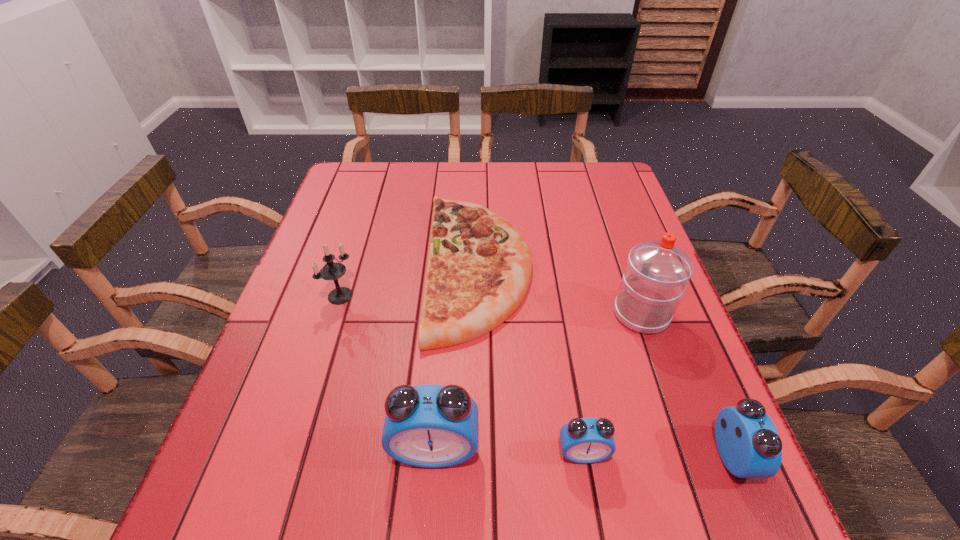
The image size is (960, 540). I want to click on free space at the right edge of the desktop, so click(x=612, y=246).

The height and width of the screenshot is (540, 960). I want to click on vacant position at the far left corner of the desktop, so click(x=371, y=181).

Locate an element on the screen. blank area at the near right corner is located at coordinates (659, 430).

Where is `empty space that is in between the third object from right to left and the leftmost object`? This screenshot has height=540, width=960. empty space that is in between the third object from right to left and the leftmost object is located at coordinates (462, 374).

You are a GUI agent. You are given a task and a screenshot of the screen. Output one action in this format:
    pyautogui.click(x=<x>, y=<y>)
    Task: Click on the empty space that is in between the pizza and the second shortest alarm clock
    
    Given the screenshot: What is the action you would take?
    pyautogui.click(x=606, y=361)

Identify the location of free point between the shortest object and the candle holder. (410, 281).

This screenshot has height=540, width=960. Find the location of `unoccupied position between the pizza and the leftmost alarm clock`. unoccupied position between the pizza and the leftmost alarm clock is located at coordinates (457, 357).

I want to click on vacant point located between the tallest object and the pizza, so pyautogui.click(x=561, y=290).

Identify the location of free space between the leftmost alarm clock and the leftmost object. (388, 373).

You are a GUI agent. You are given a task and a screenshot of the screen. Output one action in this format:
    pyautogui.click(x=<x>, y=<y>)
    Task: Click on the free space that is in between the candle holder and the tallest alarm clock
    This screenshot has height=540, width=960.
    Given the screenshot: What is the action you would take?
    pyautogui.click(x=388, y=373)